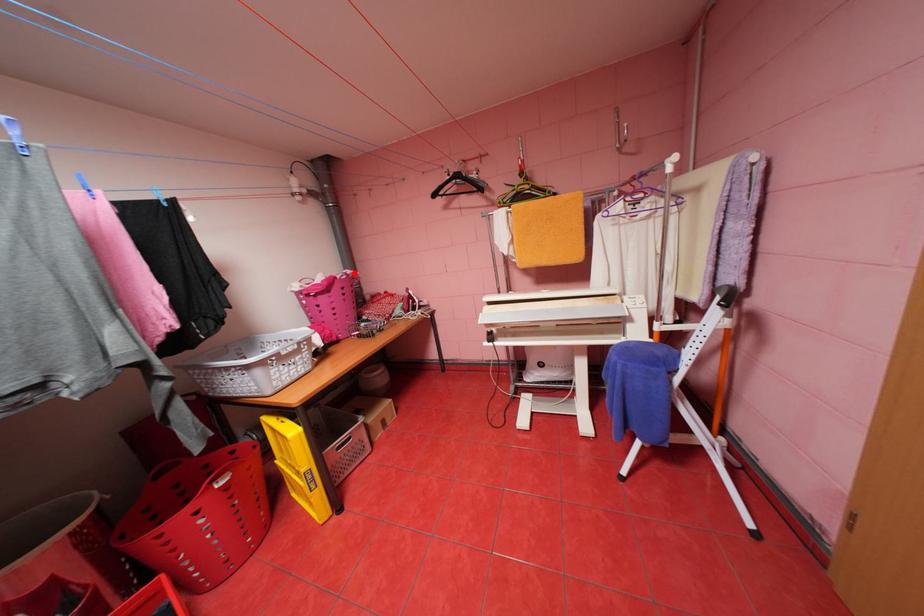
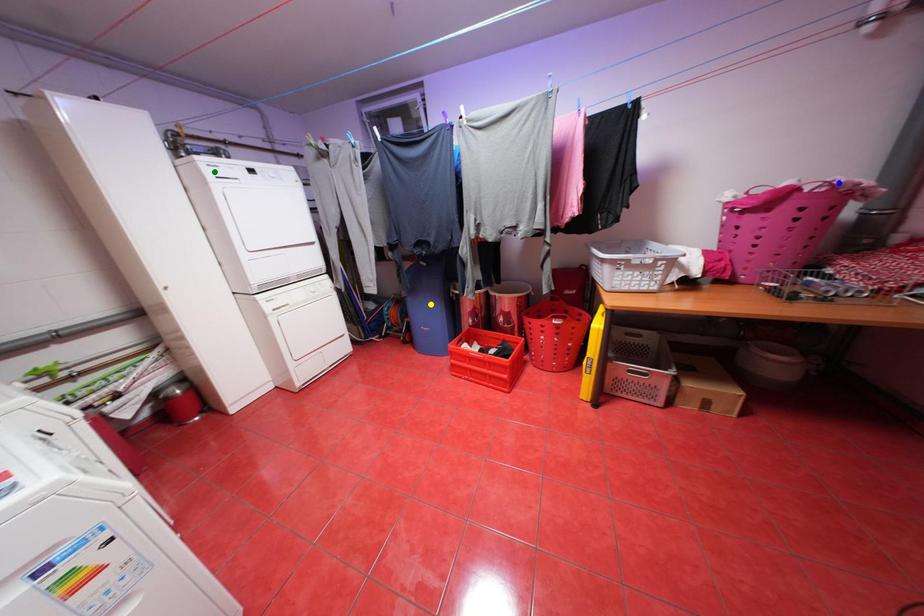
Question: I am providing you with two images of the same scene from different viewpoints. A red point is marked on the first image. You are given multiple points on the second image. Which point in image 2 represents the same 3d spot as the red point in image 1?

Choices:
 (A) blue point
 (B) yellow point
 (C) green point

Answer: (A)